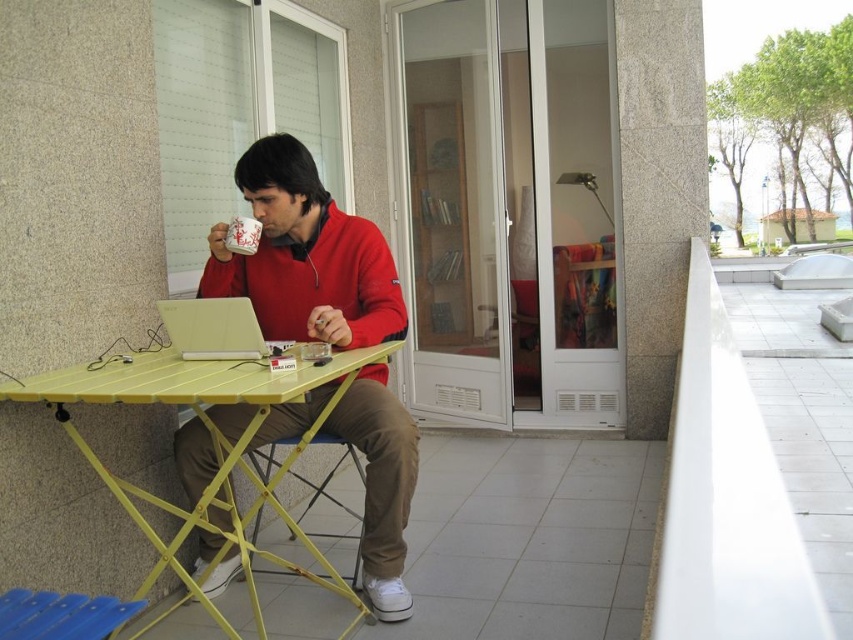
You are a delivery person who needs to place a package on the yellow plastic table at center without disturbing the matte red sweater at center. Where should you place the package?

The matte red sweater at center is on the right side of the yellow plastic table at center, so you should place the package on the left side of the yellow plastic table at center to avoid disturbing the sweater.

You are a delivery person who needs to place a package on the yellow plastic table at center. However, there is a matte red sweater at center in the way. Can you move the sweater to access the table?

The yellow plastic table at center is behind the matte red sweater at center, so you can move the matte red sweater at center to access the yellow plastic table at center.

Consider the image. You are standing in front of the sliding glass door and want to determine which of the two points, point (x=399, y=292) or point (x=93, y=468), is closer to you. Based on their positions, which point is nearer?

Point (x=399, y=292) is further to the viewer than point (x=93, y=468), so the closer point to you is point (x=93, y=468).